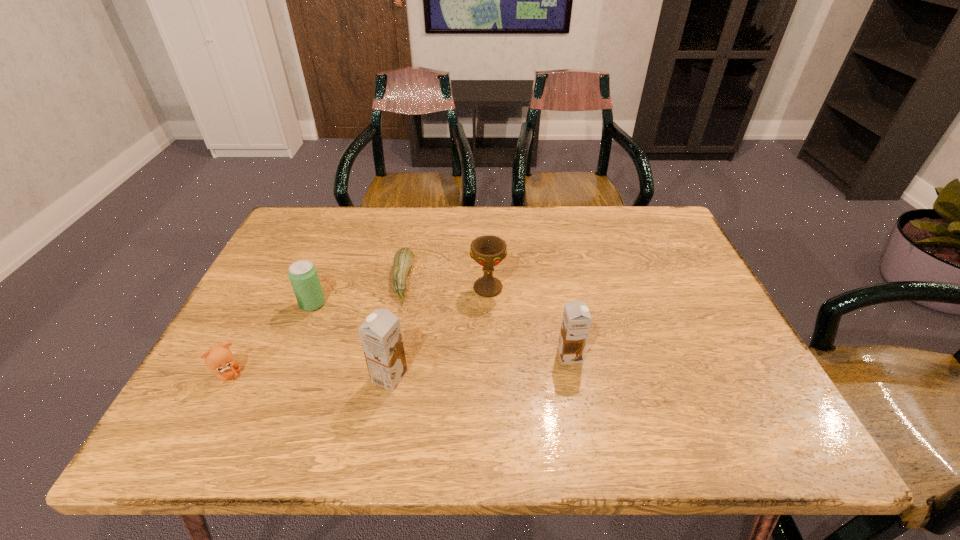
I want to click on object situated at the near left corner, so click(x=219, y=359).

Image resolution: width=960 pixels, height=540 pixels. What are the coordinates of `free point at the far edge` in the screenshot? It's located at (621, 247).

This screenshot has height=540, width=960. I want to click on vacant area at the near edge of the desktop, so click(331, 391).

The width and height of the screenshot is (960, 540). What are the coordinates of `vacant space at the left edge of the desktop` in the screenshot? It's located at (276, 276).

This screenshot has height=540, width=960. In the image, there is a desktop. Find the location of `blank space at the far right corner`. blank space at the far right corner is located at coordinates (623, 219).

At what (x,y) coordinates should I click in order to perform the action: click on vacant area that lies between the shorter chocolate milk and the tallest object. Please return your answer as a coordinate pair (x, y). The height and width of the screenshot is (540, 960). Looking at the image, I should click on (480, 366).

Locate an element on the screen. blank region between the fifth object from left to right and the fifth tallest object is located at coordinates (358, 332).

Where is `vacant region between the chalice and the teddy bear`? vacant region between the chalice and the teddy bear is located at coordinates pyautogui.click(x=358, y=332).

The image size is (960, 540). What are the coordinates of `empty space between the second shortest object and the chalice` in the screenshot? It's located at (358, 332).

Identify the location of empty space between the tallest object and the second object from right to left. (439, 332).